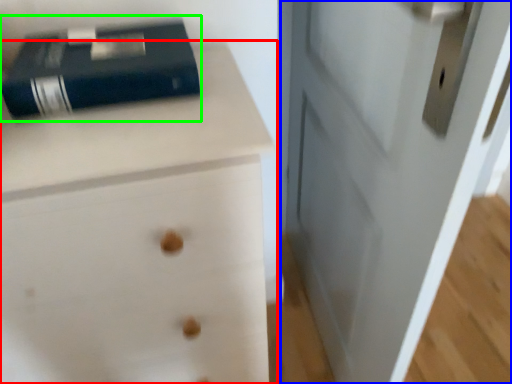
Question: Considering the real-world distances, which object is farthest from chest of drawers (highlighted by a red box)? door (highlighted by a blue box) or paperback book (highlighted by a green box)?

Choices:
 (A) door
 (B) paperback book

Answer: (A)